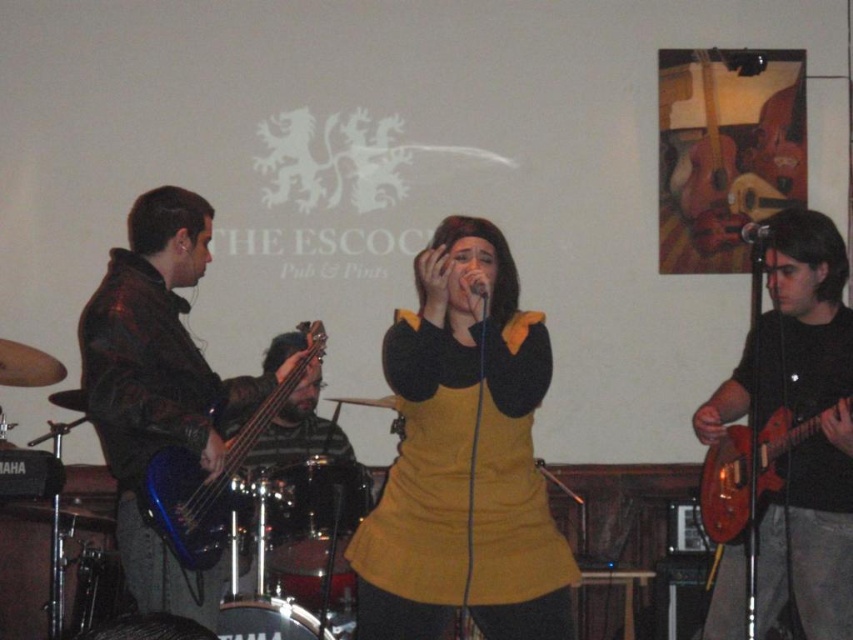
Question: Which point is farther to the camera?

Choices:
 (A) (190, 499)
 (B) (747, 484)
 (C) (491, 481)
 (D) (102, 419)

Answer: (B)

Question: Among these points, which one is farthest from the camera?

Choices:
 (A) (128, 406)
 (B) (433, 522)
 (C) (796, 538)

Answer: (C)

Question: Is yellow matte dress at center to the right of blue glossy bass guitar at left from the viewer's perspective?

Choices:
 (A) no
 (B) yes

Answer: (B)

Question: Which object is closer to the camera taking this photo?

Choices:
 (A) shiny red guitar at right
 (B) camouflage jacket at left
 (C) shiny red electric guitar at right

Answer: (B)

Question: Can you confirm if shiny red guitar at right is smaller than blue glossy bass guitar at left?

Choices:
 (A) no
 (B) yes

Answer: (A)

Question: Where is yellow matte dress at center located in relation to camouflage jacket at left in the image?

Choices:
 (A) below
 (B) above

Answer: (B)